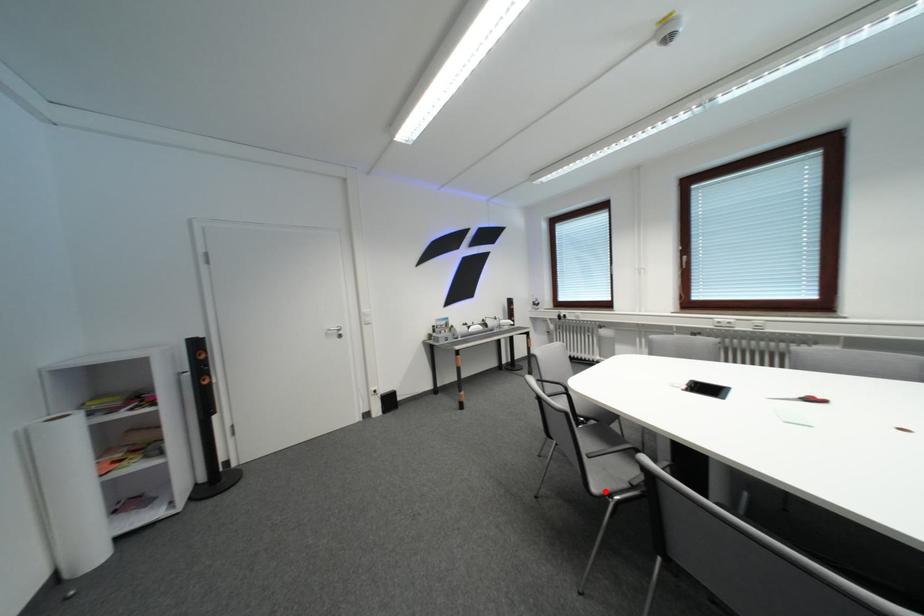
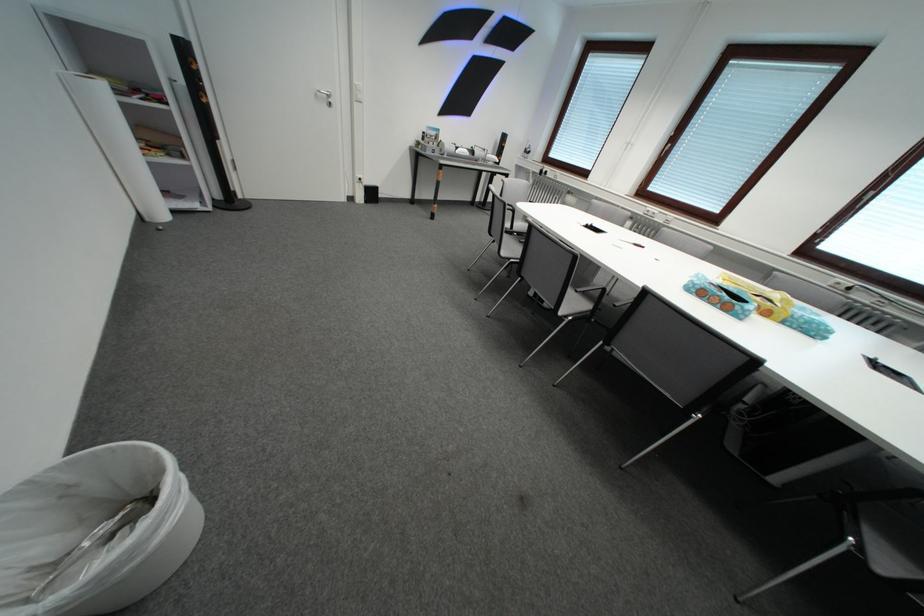
The point at the highlighted location is marked in the first image. Where is the corresponding point in the second image?

(514, 256)